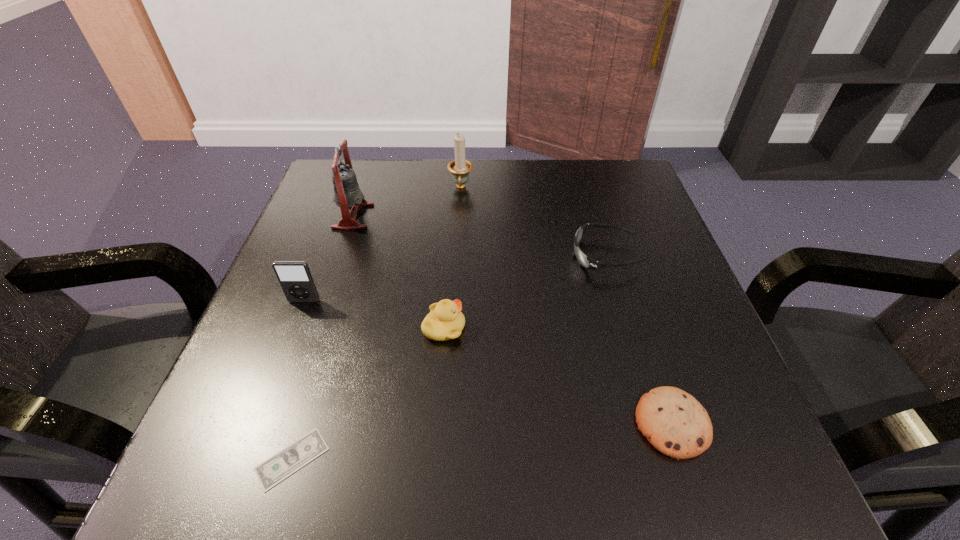
This screenshot has height=540, width=960. Find the location of `cookie`. cookie is located at coordinates (674, 422).

The height and width of the screenshot is (540, 960). Identify the location of money. (278, 467).

The width and height of the screenshot is (960, 540). Find the location of `vacant space located on the front of the second farthest object`. vacant space located on the front of the second farthest object is located at coordinates (306, 359).

This screenshot has height=540, width=960. Identify the location of free space located 0.220m on the handle side of the candle_holder. [x=457, y=256].

At what (x,y) coordinates should I click in order to perform the action: click on free space located on the front-facing side of the third tallest object. Please return your answer as a coordinate pair (x, y). Looking at the image, I should click on (284, 355).

Identify the location of vacant space located 0.260m on the beak of the third nearest object. Image resolution: width=960 pixels, height=540 pixels. (609, 328).

This screenshot has height=540, width=960. Find the location of `free space located on the lenses of the sunglasses`. free space located on the lenses of the sunglasses is located at coordinates (421, 256).

This screenshot has height=540, width=960. Find the location of `blank area located 0.280m on the lenses of the sunglasses`. blank area located 0.280m on the lenses of the sunglasses is located at coordinates (440, 256).

The height and width of the screenshot is (540, 960). In order to click on vacant space located on the lenses of the sunglasses in this screenshot , I will do `click(449, 256)`.

Locate an element on the screen. Image resolution: width=960 pixels, height=540 pixels. vacant point located 0.310m on the back of the second shortest object is located at coordinates (618, 260).